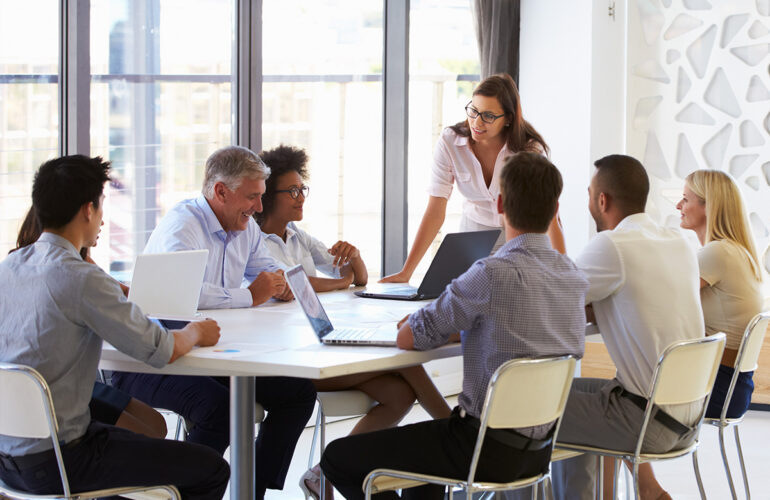
The image size is (770, 500). In order to click on window in this screenshot , I will do `click(463, 77)`, `click(339, 97)`, `click(182, 98)`, `click(39, 79)`.